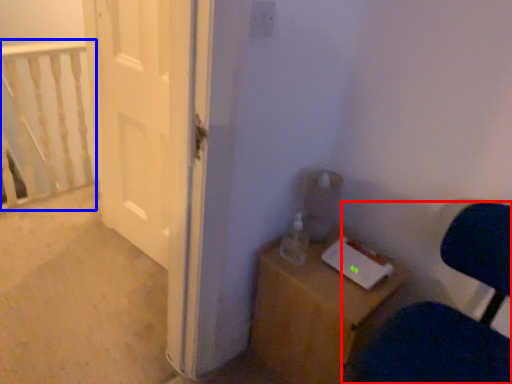
Question: Which point is further to the camera, chair (highlighted by a red box) or rail (highlighted by a blue box)?

Choices:
 (A) chair
 (B) rail

Answer: (B)